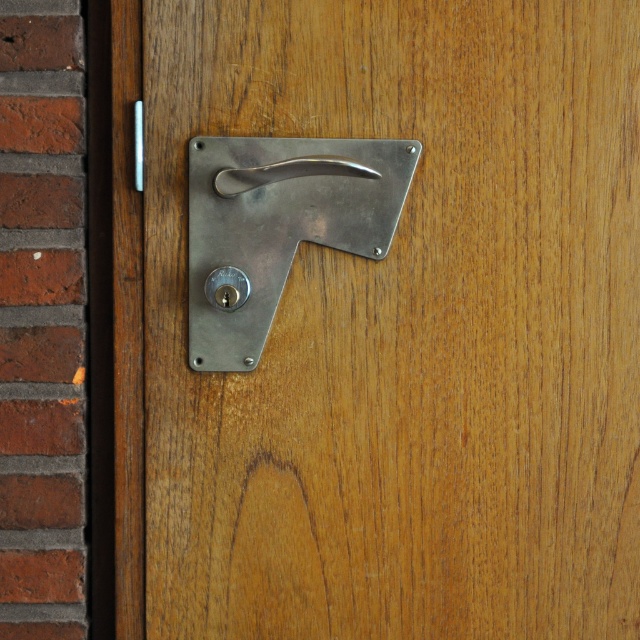
You are trying to open the door and need to reach both the polished silver handle at upper center and the polished metal latch at upper center. Which one is easier to reach without moving your hand?

The polished silver handle at upper center is closer to the viewer than the polished metal latch at upper center, so it is easier to reach without moving your hand.

You are trying to open the door and notice two metallic parts. Which one should you grab first, the polished metal door handle at center or the polished metal latch at upper center?

You should grab the polished metal door handle at center first because it is in front of the polished metal latch at upper center, making it more accessible.